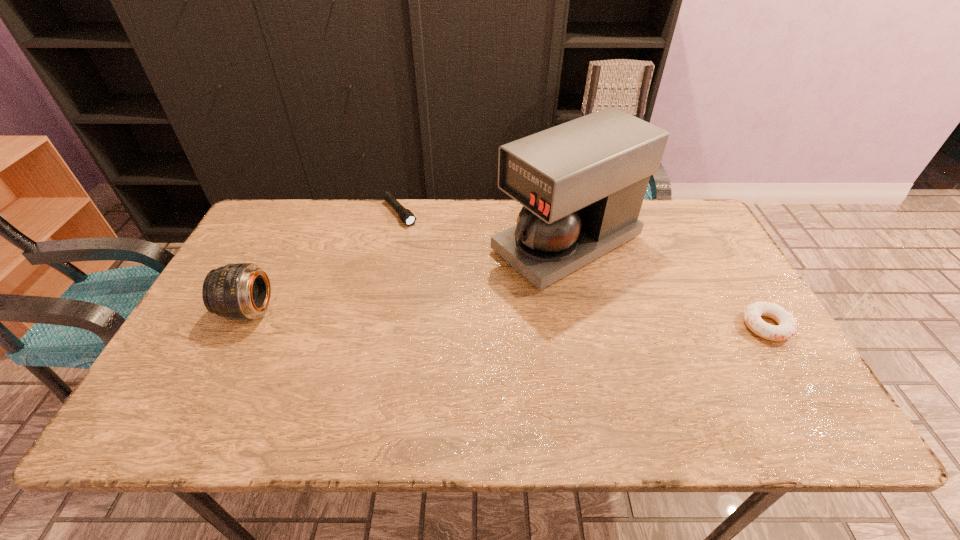
This screenshot has width=960, height=540. What are the coordinates of `free space between the rightmost object and the third shortest object` in the screenshot? It's located at (507, 318).

The image size is (960, 540). I want to click on free spot between the tallest object and the telephoto lens, so click(x=407, y=277).

I want to click on empty location between the second object from right to left and the flashlight, so click(483, 228).

Locate an element on the screen. object that ranks as the third closest to the doughnut is located at coordinates (242, 291).

Locate which object is the closest to the doughnut. Please provide its 2D coordinates. Your answer should be formatted as a tuple, i.e. [(x, y)], where the tuple contains the x and y coordinates of a point satisfying the conditions above.

[(582, 183)]